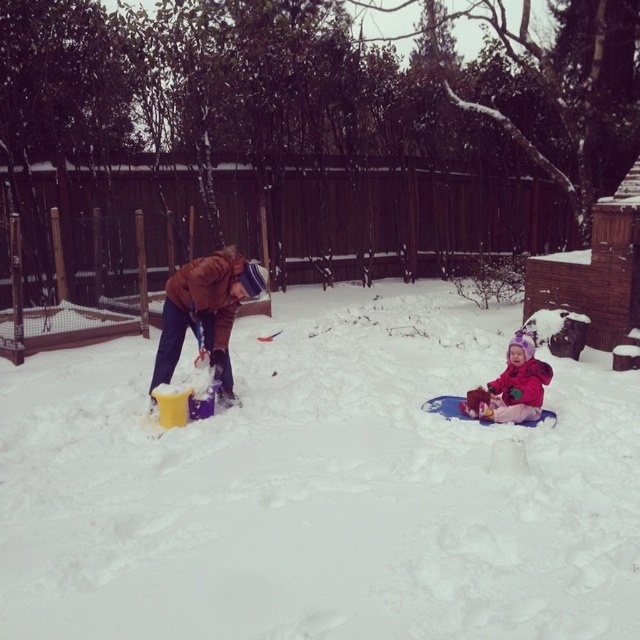
Between white fluffy snow at center and brown leather jacket at center, which one has more height?

brown leather jacket at center

Looking at this image, is white fluffy snow at center further to camera compared to brown leather jacket at center?

No, it is not.

Based on the photo, who is more distant from viewer, (349, 632) or (221, 259)?

Positioned behind is point (221, 259).

Where is `white fluffy snow at center`? white fluffy snow at center is located at coordinates (320, 486).

Which of these two, white fluffy snow at center or fluffy pink snowsuit at lower right, stands taller?

With more height is white fluffy snow at center.

Is white fluffy snow at center to the left of fluffy pink snowsuit at lower right from the viewer's perspective?

Yes, white fluffy snow at center is to the left of fluffy pink snowsuit at lower right.

Find the location of a particular element. Image resolution: width=640 pixels, height=640 pixels. white fluffy snow at center is located at coordinates (320, 486).

The image size is (640, 640). Find the location of `brown leather jacket at center`. brown leather jacket at center is located at coordinates (205, 310).

Is point (227, 388) less distant than point (515, 372)?

No, (227, 388) is further to viewer.

This screenshot has height=640, width=640. Find the location of `brown leather jacket at center`. brown leather jacket at center is located at coordinates (205, 310).